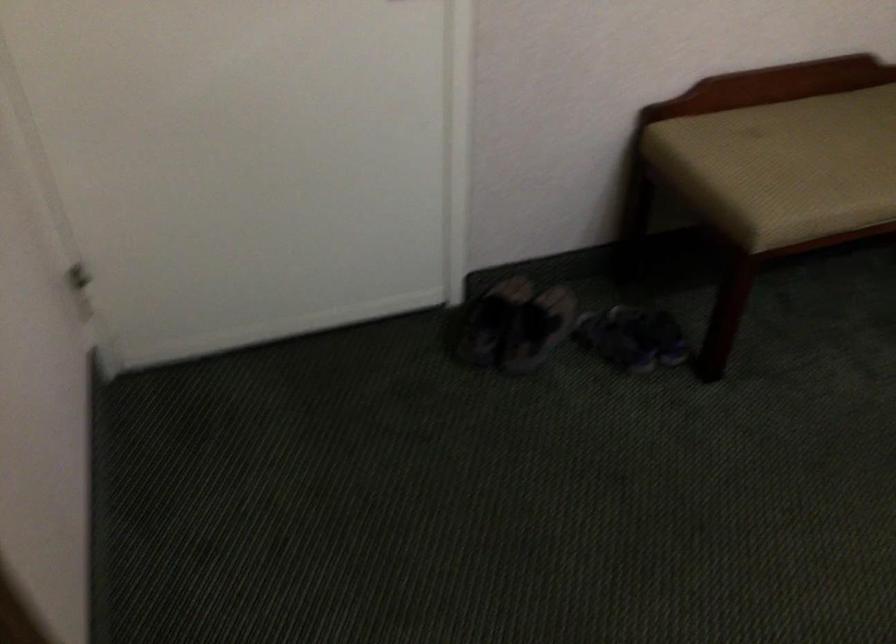
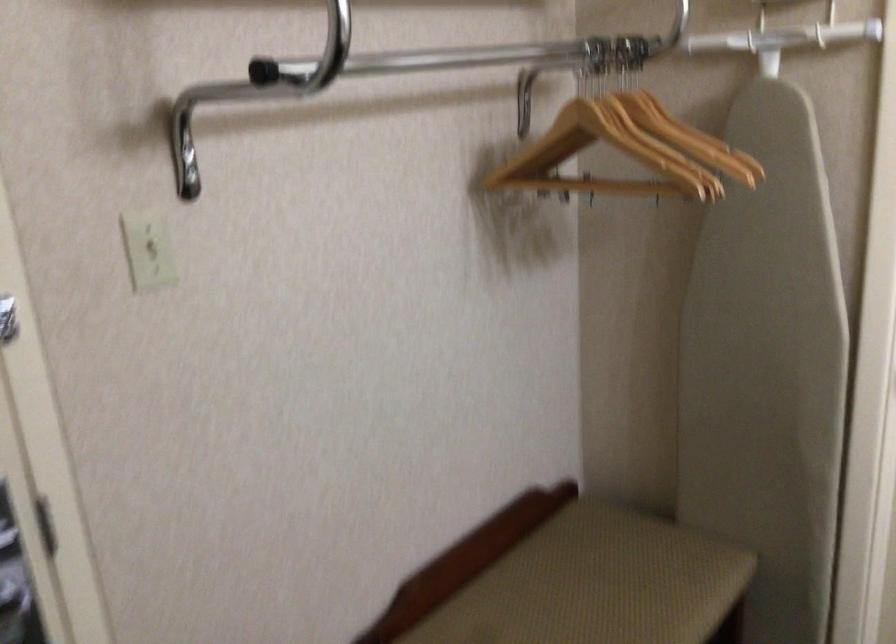
The images are taken continuously from a first-person perspective. In which direction is your viewpoint rotating?

The camera's rotation is toward right-up.